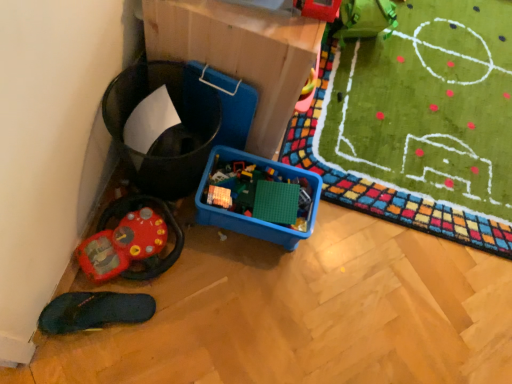
Question: From the image's perspective, is rubberized red steering wheel at lower left, which is the 1th toy from bottom to top, above or below black rubber slipper at lower left?

Choices:
 (A) above
 (B) below

Answer: (A)

Question: Based on their sizes in the image, would you say rubberized red steering wheel at lower left, which appears as the first toy when viewed from the back, is bigger or smaller than black rubber slipper at lower left?

Choices:
 (A) big
 (B) small

Answer: (A)

Question: Which object is positioned farthest from the rubberized plastic toy at upper right, marked as the 1th toy in a top-to-bottom arrangement?

Choices:
 (A) black rubber slipper at lower left
 (B) rubberized red steering wheel at lower left, which appears as the second toy when viewed from the right
 (C) cardboard at upper center

Answer: (A)

Question: Considering the real-world distances, which object is closest to the black rubber slipper at lower left?

Choices:
 (A) cardboard at upper center
 (B) rubberized red steering wheel at lower left, which appears as the second toy when viewed from the top
 (C) rubberized plastic toy at upper right, marked as the 1th toy in a top-to-bottom arrangement

Answer: (B)